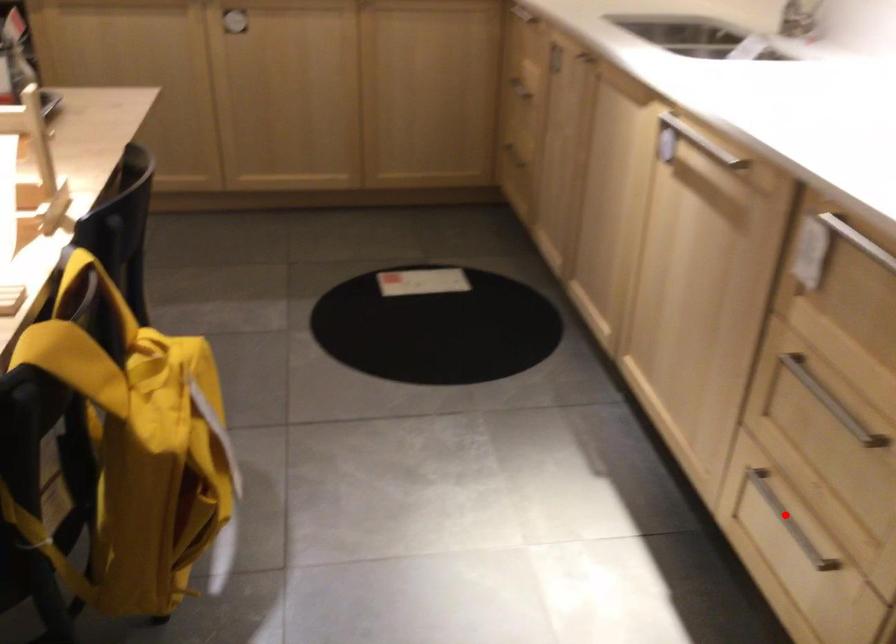
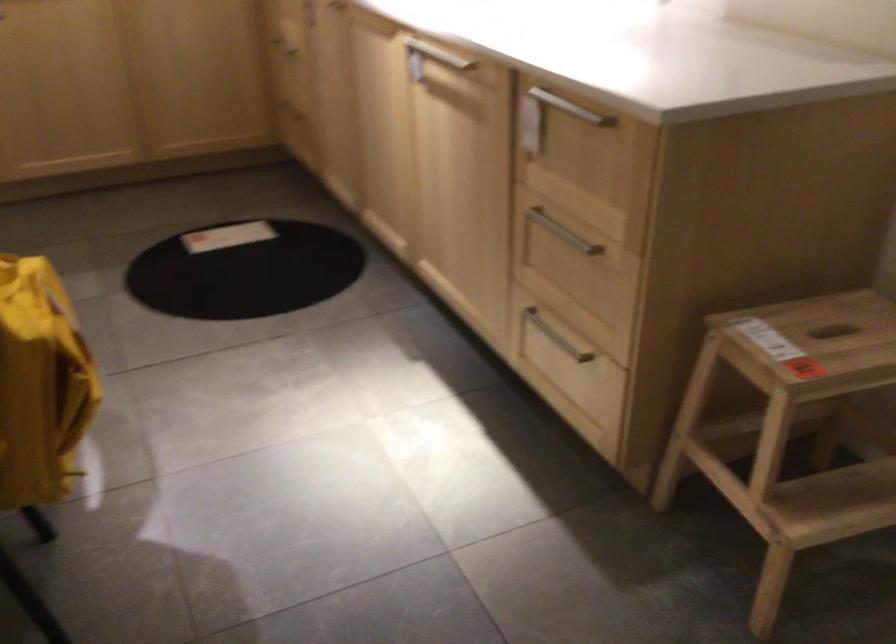
Question: I am providing you with two images of the same scene from different viewpoints. Image1 has a red point marked. In image2, the corresponding 3D location appears at what relative position? Reply with the corresponding letter.

Choices:
 (A) Closer
 (B) Farther

Answer: (B)